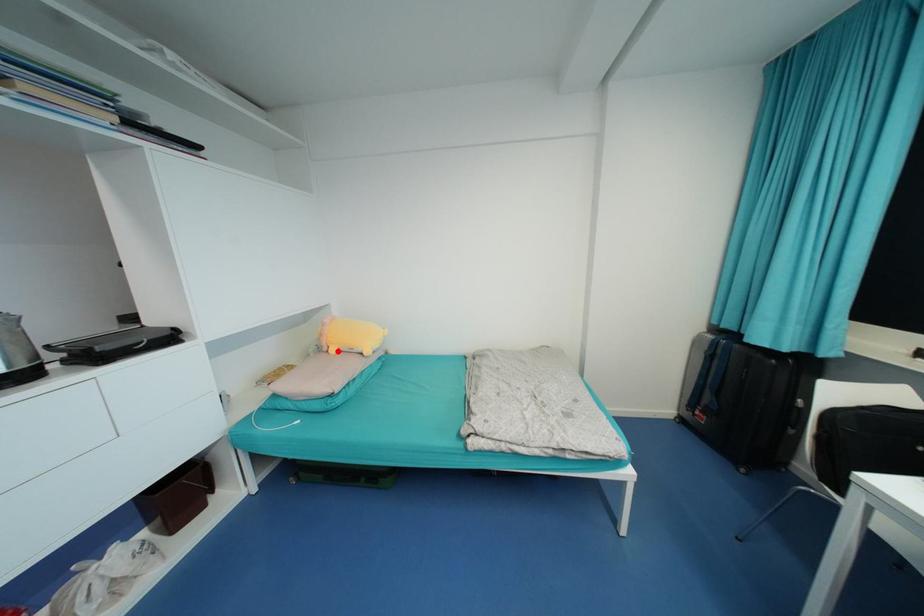
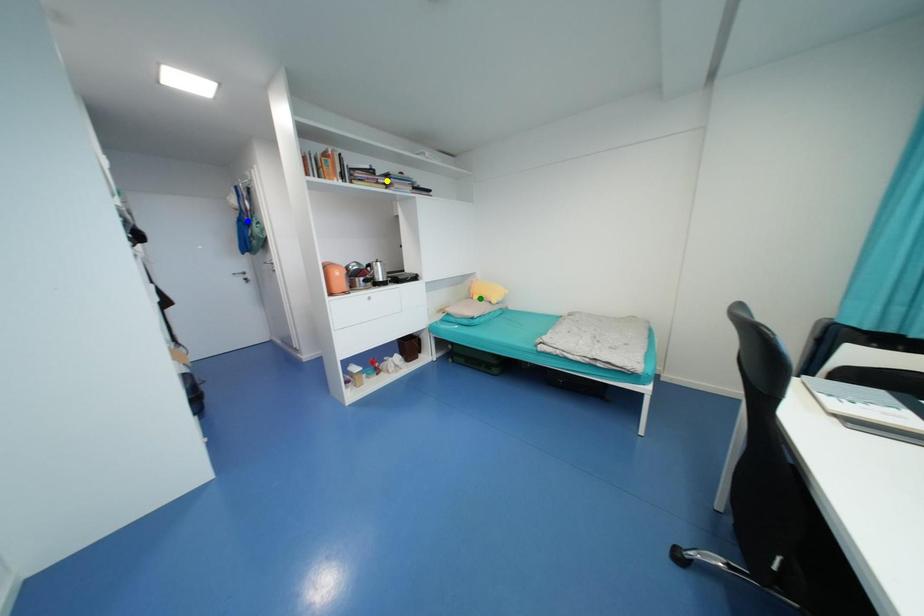
Question: I am providing you with two images of the same scene from different viewpoints. A red point is marked on the first image. You are given multiple points on the second image. In image 2, which mark is for the same physical point as the one in image 1?

Choices:
 (A) green point
 (B) yellow point
 (C) blue point

Answer: (A)